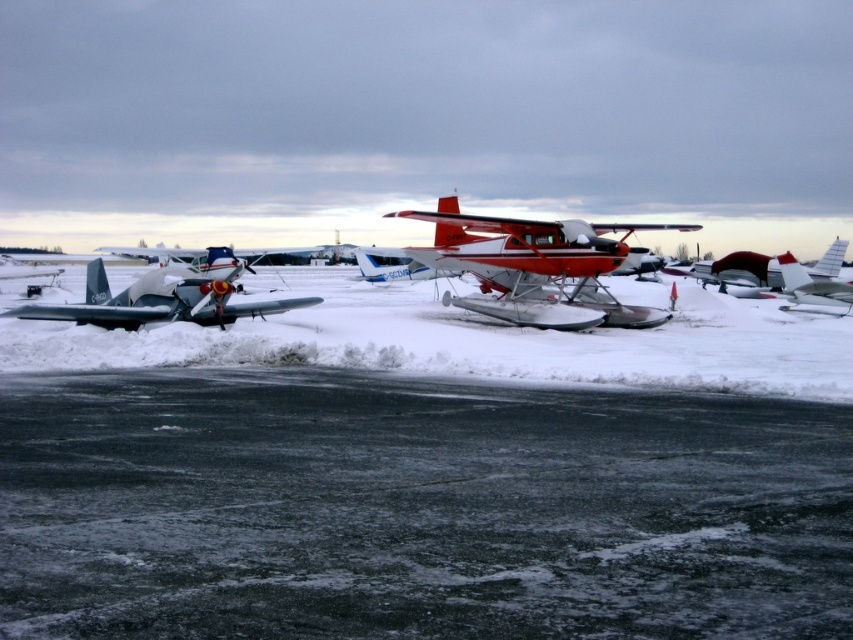
In the scene shown: Is white matte snow at center smaller than red polished aluminum seaplane at center?

No.

Is white matte snow at center positioned in front of red polished aluminum seaplane at center?

That is True.

In order to click on white matte snow at center in this screenshot , I will do `click(469, 340)`.

Is black asphalt tarmac at lower center bigger than white matte snow at center?

No.

Which is in front, point (793, 515) or point (683, 376)?

Positioned in front is point (793, 515).

Locate an element on the screen. This screenshot has width=853, height=640. black asphalt tarmac at lower center is located at coordinates (415, 508).

Can you confirm if black asphalt tarmac at lower center is shorter than silver metallic airplane at left?

In fact, black asphalt tarmac at lower center may be taller than silver metallic airplane at left.

Is black asphalt tarmac at lower center thinner than silver metallic airplane at left?

No, black asphalt tarmac at lower center is not thinner than silver metallic airplane at left.

Is point (824, 586) farther from viewer compared to point (229, 275)?

That is False.

The width and height of the screenshot is (853, 640). I want to click on black asphalt tarmac at lower center, so click(x=415, y=508).